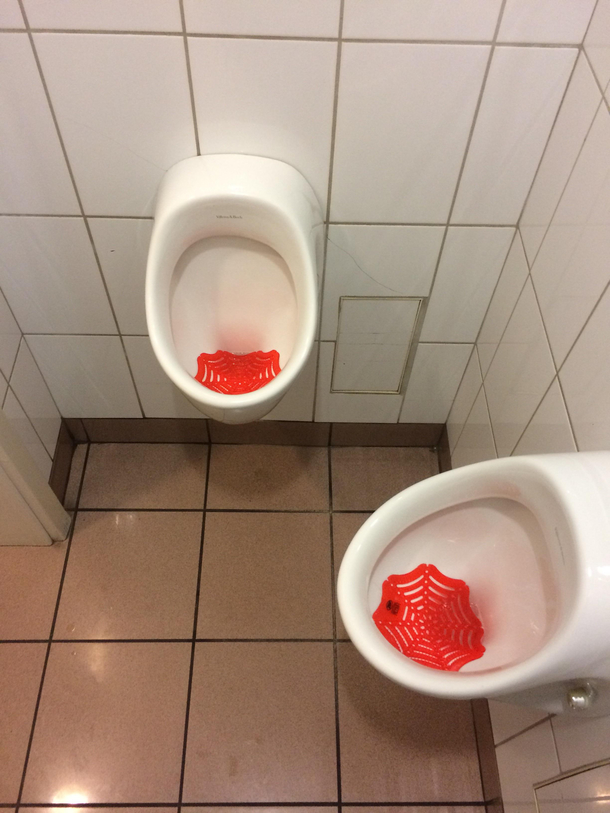
The width and height of the screenshot is (610, 813). What are the coordinates of `splash guard` in the screenshot? It's located at tap(438, 615), tap(237, 376).